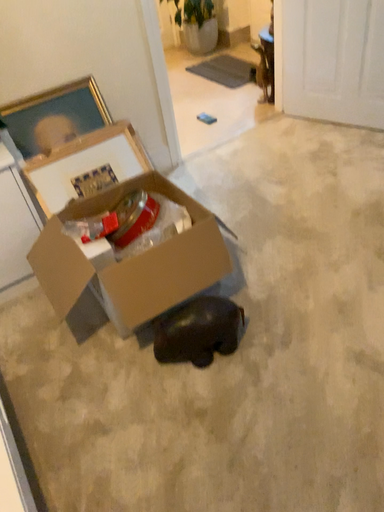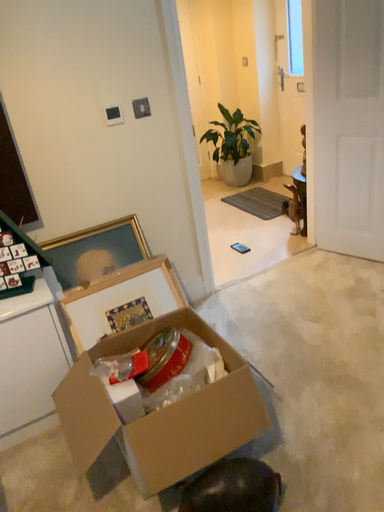
Question: Which way did the camera rotate in the video?

Choices:
 (A) rotated downward
 (B) rotated upward

Answer: (B)